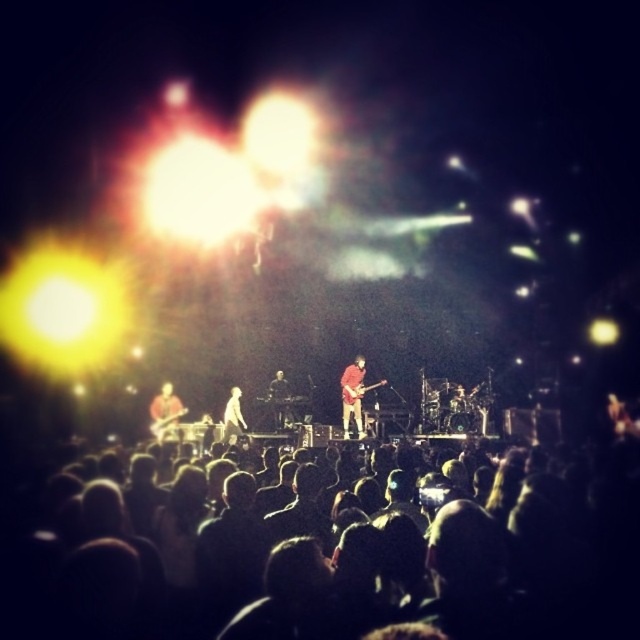
Question: Among these objects, which one is nearest to the camera?

Choices:
 (A) red fabric guitar at center
 (B) dark matte crowd at lower center
 (C) white fabric at center

Answer: (B)

Question: Does dark matte crowd at lower center have a smaller size compared to glossy wood electric guitar at center?

Choices:
 (A) no
 (B) yes

Answer: (A)

Question: Which of the following is the closest to the observer?

Choices:
 (A) white fabric at center
 (B) glossy wood electric guitar at center
 (C) smooth black guitar at center
 (D) dark matte crowd at lower center

Answer: (D)

Question: Which point is farther from the camera taking this photo?

Choices:
 (A) (280, 374)
 (B) (237, 435)
 (C) (352, 417)

Answer: (A)

Question: Is smooth black guitar at center to the right of white fabric at center from the viewer's perspective?

Choices:
 (A) no
 (B) yes

Answer: (B)

Question: Does matte black guitar at center appear on the left side of smooth black guitar at center?

Choices:
 (A) no
 (B) yes

Answer: (B)